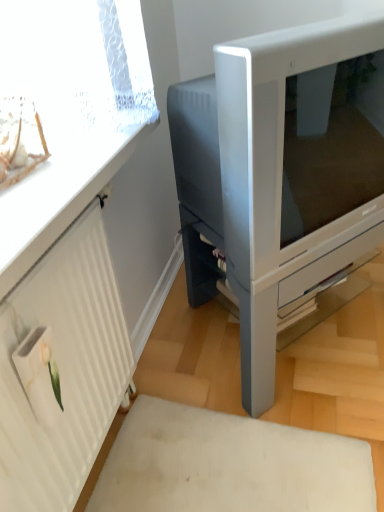
Locate an element on the screen. The image size is (384, 512). vacant space that's between satin silver monitor at center and white textured radiator at left is located at coordinates (178, 428).